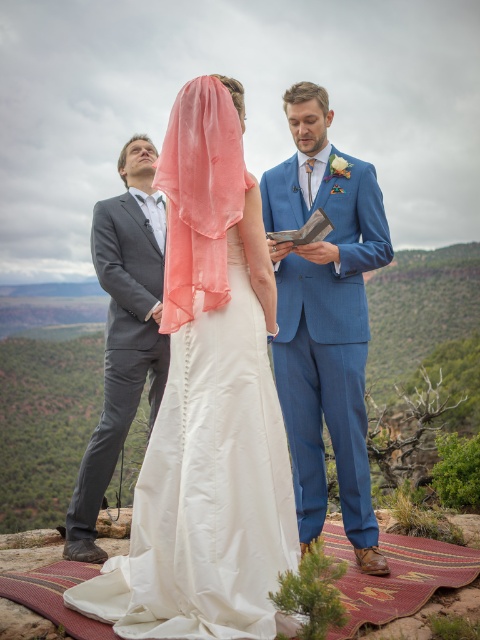
Question: Is blue wool suit at center to the left of coral sheer veil at center from the viewer's perspective?

Choices:
 (A) yes
 (B) no

Answer: (B)

Question: Which point is closer to the camera taking this photo?

Choices:
 (A) (109, 262)
 (B) (309, 461)

Answer: (B)

Question: Among these points, which one is farthest from the camera?

Choices:
 (A) (168, 257)
 (B) (175, 465)

Answer: (A)

Question: Among these points, which one is farthest from the camera?

Choices:
 (A) (101, 429)
 (B) (135, 602)
 (C) (350, 486)

Answer: (A)

Question: Is the position of white satin dress at center more distant than that of matte gray suit at left?

Choices:
 (A) no
 (B) yes

Answer: (A)

Question: Is white satin dress at center thinner than blue wool suit at center?

Choices:
 (A) no
 (B) yes

Answer: (A)